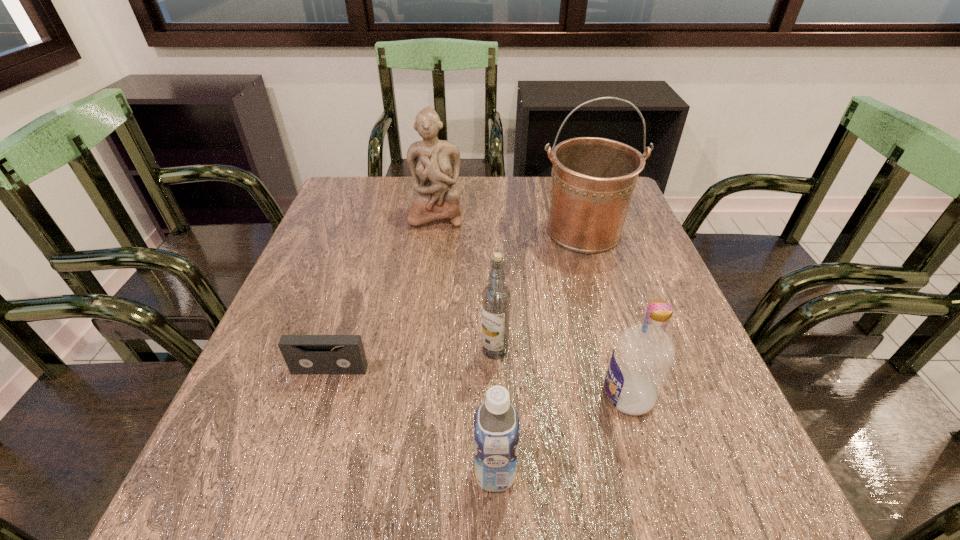
Identify the location of bucket. This screenshot has width=960, height=540. (593, 179).

What are the coordinates of `figurine` in the screenshot? It's located at (434, 164).

You are a GUI agent. You are given a task and a screenshot of the screen. Output one action in this format:
    pyautogui.click(x=<x>, y=<y>)
    Task: Click on the fifth shortest object
    
    Given the screenshot: What is the action you would take?
    pyautogui.click(x=434, y=164)

Locate an element on the screen. the third farthest object is located at coordinates coord(496,297).

Where is `the left vodka`? the left vodka is located at coordinates (496, 297).

Where is `the nearer vodka`? Image resolution: width=960 pixels, height=540 pixels. the nearer vodka is located at coordinates (642, 358).

The image size is (960, 540). What are the coordinates of `the second nearest object` in the screenshot? It's located at (642, 358).

Locate an element on the screen. The image size is (960, 540). the nearest object is located at coordinates point(496,422).

Where is `the shortest object`? the shortest object is located at coordinates (304, 354).

In order to click on the third nearest object in this screenshot , I will do `click(304, 354)`.